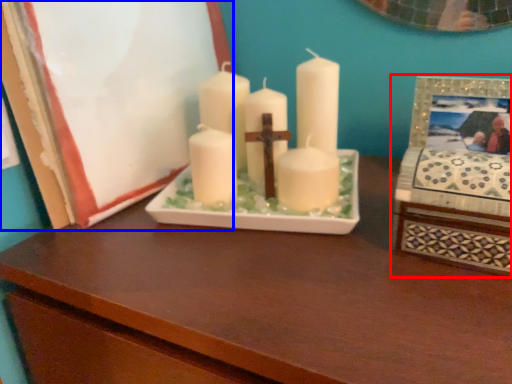
Question: Which object is further to the camera taking this photo, picture frame (highlighted by a red box) or picture frame (highlighted by a blue box)?

Choices:
 (A) picture frame
 (B) picture frame

Answer: (B)